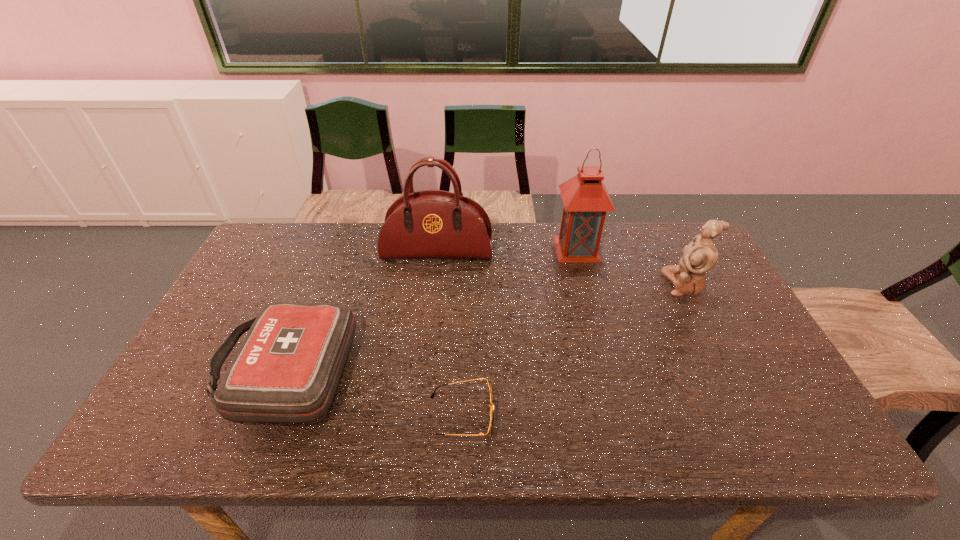
Image resolution: width=960 pixels, height=540 pixels. Identify the location of the fourth object from left to right. (585, 198).

Where is `handbag`? The image size is (960, 540). handbag is located at coordinates (430, 224).

Where is `the third nearest object`? The width and height of the screenshot is (960, 540). the third nearest object is located at coordinates (700, 256).

I want to click on the rightmost object, so click(700, 256).

You are a GUI agent. You are given a task and a screenshot of the screen. Output one action in this format:
    pyautogui.click(x=<x>, y=<y>)
    Task: Click on the fourth tallest object
    
    Given the screenshot: What is the action you would take?
    pyautogui.click(x=287, y=370)

The height and width of the screenshot is (540, 960). I want to click on the leftmost object, so click(x=287, y=370).

Where is `the shortest object`? The height and width of the screenshot is (540, 960). the shortest object is located at coordinates (491, 416).

Where is `blank space located on the front of the fourth object from left to right`? This screenshot has height=540, width=960. blank space located on the front of the fourth object from left to right is located at coordinates (594, 316).

Where is `free space located 0.270m on the front-facing side of the handbag`? The height and width of the screenshot is (540, 960). free space located 0.270m on the front-facing side of the handbag is located at coordinates (429, 330).

Locate an element on the screen. Image resolution: width=960 pixels, height=540 pixels. vacant region located on the front-facing side of the rightmost object is located at coordinates (635, 284).